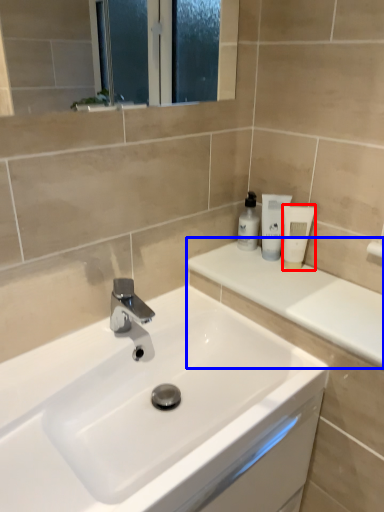
Question: Which object appears closest to the camera in this image, toiletry (highlighted by a red box) or counter top (highlighted by a blue box)?

Choices:
 (A) toiletry
 (B) counter top

Answer: (B)